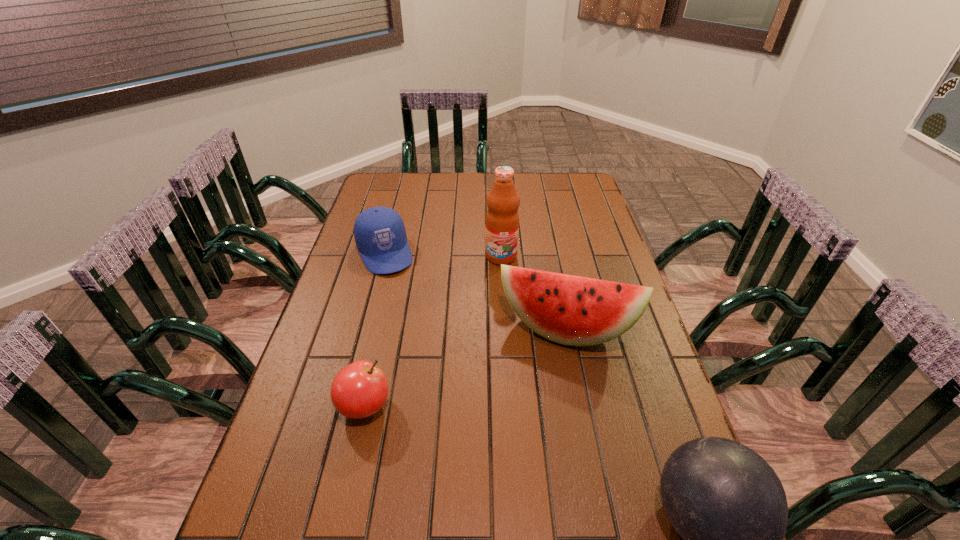
Where is `the second nearest object`? This screenshot has height=540, width=960. the second nearest object is located at coordinates (359, 390).

At what (x,y) coordinates should I click in order to perform the action: click on the tallest object. Please return your answer as a coordinate pair (x, y). The width and height of the screenshot is (960, 540). Looking at the image, I should click on (502, 220).

Identify the location of the third nearest object. (571, 310).

At what (x,y) coordinates should I click in order to perform the action: click on cap. Please return your answer as a coordinate pair (x, y). Image resolution: width=960 pixels, height=540 pixels. Looking at the image, I should click on (379, 232).

Where is `vacant space located 0.270m on the stem of the fourth farthest object`? vacant space located 0.270m on the stem of the fourth farthest object is located at coordinates (505, 406).

You are a GUI agent. You are given a task and a screenshot of the screen. Output one action in this format:
    pyautogui.click(x=<x>, y=<y>)
    Task: Click on the free region located 0.210m on the front label of the tallest object
    Image resolution: width=960 pixels, height=540 pixels.
    Given the screenshot: What is the action you would take?
    pyautogui.click(x=499, y=312)

Identify the location of vacant space situated 0.140m on the front label of the tallest object. (500, 296).

Image resolution: width=960 pixels, height=540 pixels. What are the coordinates of `vacant space located 0.200m on the front label of the tallest object` in the screenshot? It's located at (499, 310).

I want to click on free spot located 0.140m on the outer rind of the watermelon, so click(x=546, y=400).

You are a GUI agent. You are given a task and a screenshot of the screen. Output one action in this format:
    pyautogui.click(x=<x>, y=<y>)
    Task: Click on the free spot located 0.140m on the outer rind of the watermelon
    The height and width of the screenshot is (540, 960).
    Given the screenshot: What is the action you would take?
    pyautogui.click(x=546, y=400)